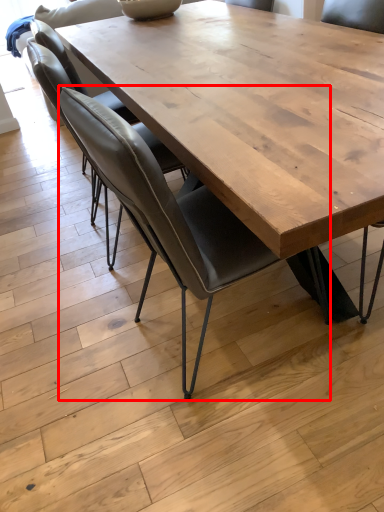
Question: Considering the relative positions of chair (annotated by the red box) and chair in the image provided, where is chair (annotated by the red box) located with respect to the staircase?

Choices:
 (A) left
 (B) right

Answer: (B)